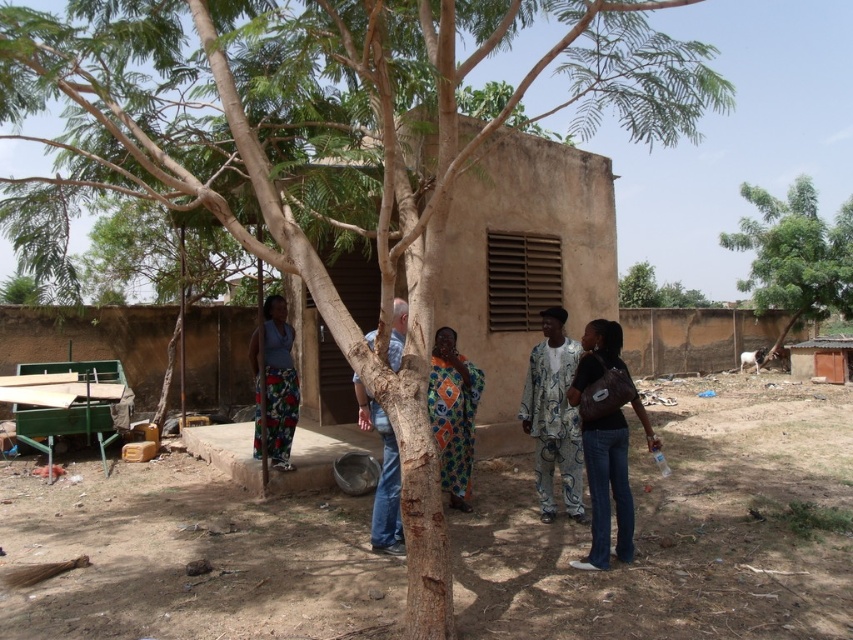
Looking at this image, you are standing in the rural outdoor scene and notice the dark brown leather handbag at lower right and the multicolored fabric dress at center. Which object is positioned more to the east side of the scene?

The dark brown leather handbag at lower right is to the right of the multicolored fabric dress at center, so it is positioned more to the east side of the scene.

You are standing in front of the rural outdoor scene described. There are two points marked in the image, one at coordinates point [608,483] and another at point [451,451]. Which point is closer to you?

Point [608,483] is closer to the viewer than point [451,451].